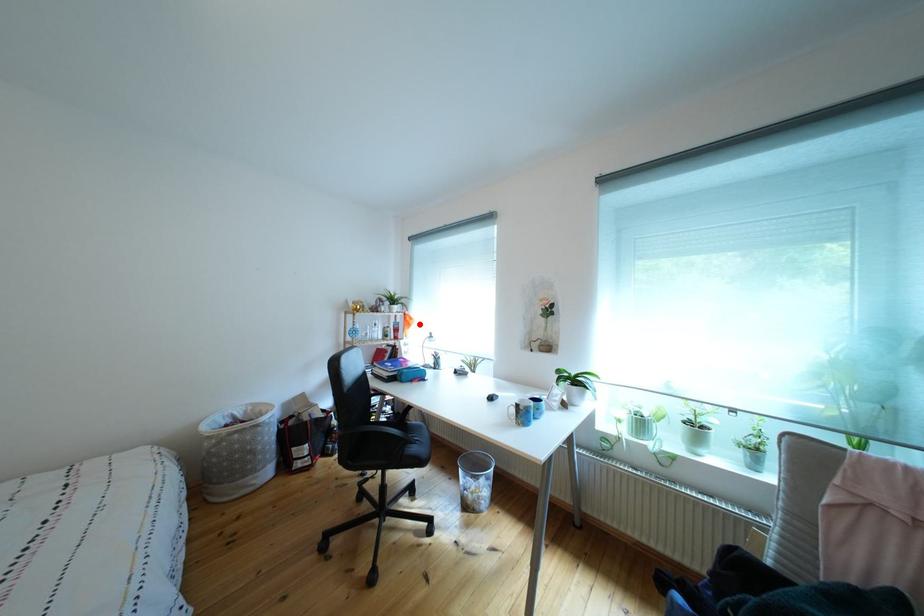
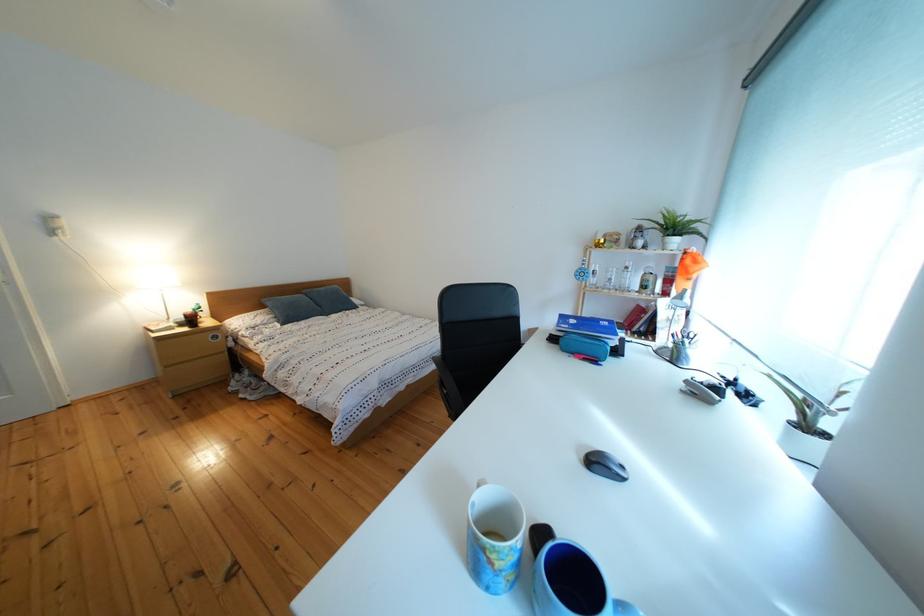
Locate, in the second image, the point that corresponds to the highlighted location in the first image.

(699, 267)